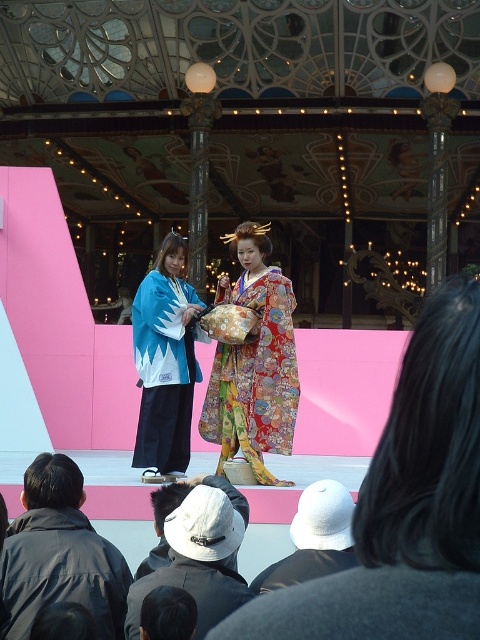
Does point (296, 401) come farther from viewer compared to point (222, 497)?

Yes, point (296, 401) is farther from viewer.

Based on the photo, which is more to the right, floral silk kimono at center or white fabric hat at lower center?

Positioned to the right is floral silk kimono at center.

Locate an element on the screen. Image resolution: width=480 pixels, height=640 pixels. floral silk kimono at center is located at coordinates (255, 355).

I want to click on floral silk kimono at center, so click(255, 355).

Does floral silk kimono at center have a greater height compared to white cotton hat at lower center?

Yes, floral silk kimono at center is taller than white cotton hat at lower center.

The width and height of the screenshot is (480, 640). What do you see at coordinates (255, 355) in the screenshot?
I see `floral silk kimono at center` at bounding box center [255, 355].

The width and height of the screenshot is (480, 640). What are the coordinates of `floral silk kimono at center` in the screenshot? It's located at (255, 355).

Who is shorter, floral silk kimono at center or blue and white kimono at center?

blue and white kimono at center is shorter.

Can you confirm if floral silk kimono at center is bigger than blue and white kimono at center?

Yes.

The width and height of the screenshot is (480, 640). In order to click on floral silk kimono at center in this screenshot , I will do `click(255, 355)`.

Locate an element on the screen. floral silk kimono at center is located at coordinates (255, 355).